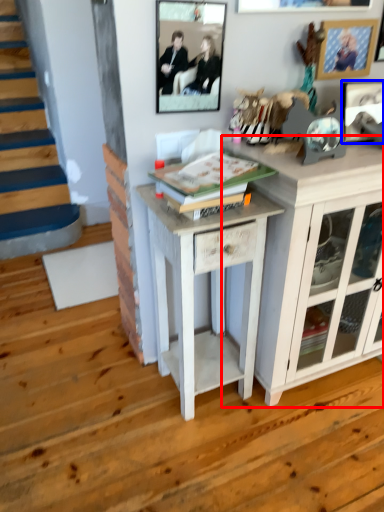
Question: Among these objects, which one is farthest to the camera, cabinetry (highlighted by a red box) or picture frame (highlighted by a blue box)?

Choices:
 (A) cabinetry
 (B) picture frame

Answer: (B)